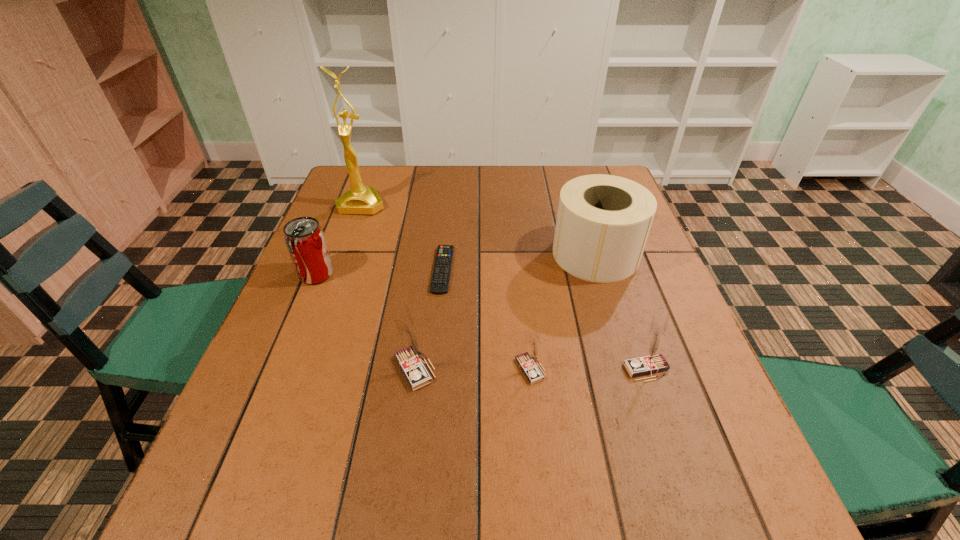
The height and width of the screenshot is (540, 960). What are the coordinates of `toilet tissue that is at the right edge` in the screenshot? It's located at (603, 221).

Find the location of a particular element. Image resolution: width=960 pixels, height=540 pixels. object that is at the far left corner is located at coordinates (360, 199).

At what (x,y) coordinates should I click in order to perform the action: click on free region at the far edge of the desktop. Please return your answer as a coordinate pair (x, y). This screenshot has width=960, height=540. Looking at the image, I should click on (428, 175).

Image resolution: width=960 pixels, height=540 pixels. In the image, there is a desktop. Find the location of `vacant space at the near edge`. vacant space at the near edge is located at coordinates (375, 432).

The height and width of the screenshot is (540, 960). In the image, there is a desktop. Find the location of `free space at the left edge`. free space at the left edge is located at coordinates (359, 240).

I want to click on vacant space at the right edge, so click(626, 302).

Identify the location of empty space that is in between the pop soda and the shortest matchbox. The width and height of the screenshot is (960, 540). (423, 322).

Find the location of a particular element. unoccupied position between the toilet tissue and the remote control is located at coordinates (519, 262).

Locate an element on the screen. Image resolution: width=960 pixels, height=540 pixels. free space between the award and the pop soda is located at coordinates point(339,239).

Identify the location of free space between the leftmost matchbox and the toilet tissue. (505, 312).